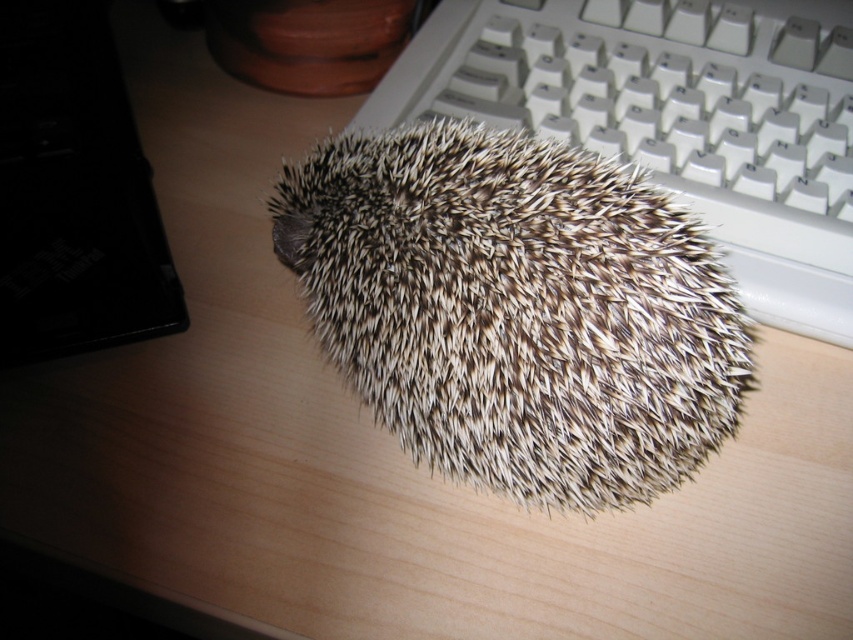
Can you confirm if brown spiny hedgehog at center is thinner than white plastic keyboard at upper right?

Correct, brown spiny hedgehog at center's width is less than white plastic keyboard at upper right's.

The height and width of the screenshot is (640, 853). I want to click on brown spiny hedgehog at center, so click(x=517, y=308).

Between point (637, 328) and point (738, 65), which one is positioned in front?

Point (637, 328) is more forward.

Image resolution: width=853 pixels, height=640 pixels. I want to click on brown spiny hedgehog at center, so click(x=517, y=308).